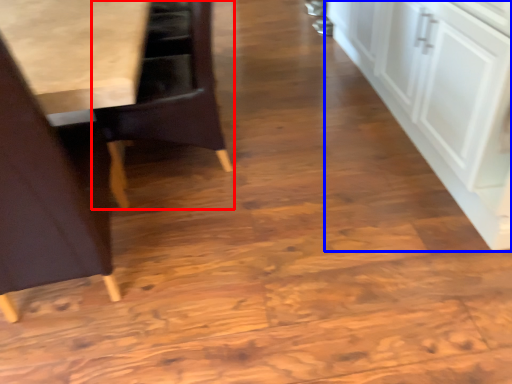
Question: Which point is further to the camera, chair (highlighted by a red box) or cabinetry (highlighted by a blue box)?

Choices:
 (A) chair
 (B) cabinetry

Answer: (A)